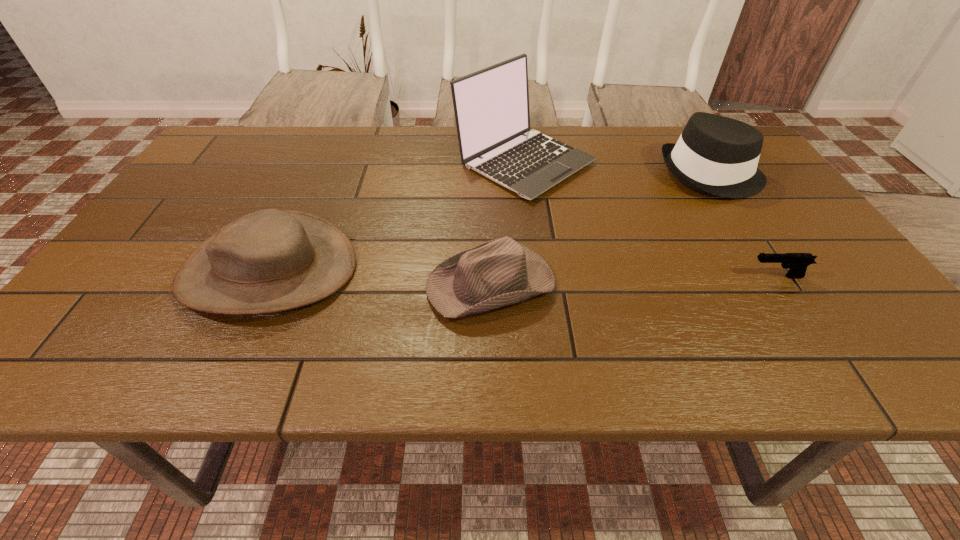
This screenshot has height=540, width=960. I want to click on empty space between the laptop_computer and the pistol, so click(x=650, y=219).

You are a GUI agent. You are given a task and a screenshot of the screen. Output one action in this format:
    pyautogui.click(x=<x>, y=<y>)
    Task: Click on the vacant space that is in between the farther fedora and the left fedora
    The height and width of the screenshot is (540, 960).
    Given the screenshot: What is the action you would take?
    point(601,229)

Locate which object ranks in proximity to the leftmost object. Please provide its 2D coordinates. Your answer should be formatted as a tuple, i.e. [(x, y)], where the tuple contains the x and y coordinates of a point satisfying the conditions above.

[(501, 272)]

The width and height of the screenshot is (960, 540). I want to click on object that is the nearest to the left fedora, so click(x=272, y=260).

Where is `free point that satisfies the following two spatial constraints: 1. on the front side of the shorter fedora; 2. on the left side of the leftmost object`? free point that satisfies the following two spatial constraints: 1. on the front side of the shorter fedora; 2. on the left side of the leftmost object is located at coordinates (262, 284).

Locate an element on the screen. free location that satisfies the following two spatial constraints: 1. on the front side of the right fedora; 2. on the front-facing side of the shortest object is located at coordinates (779, 276).